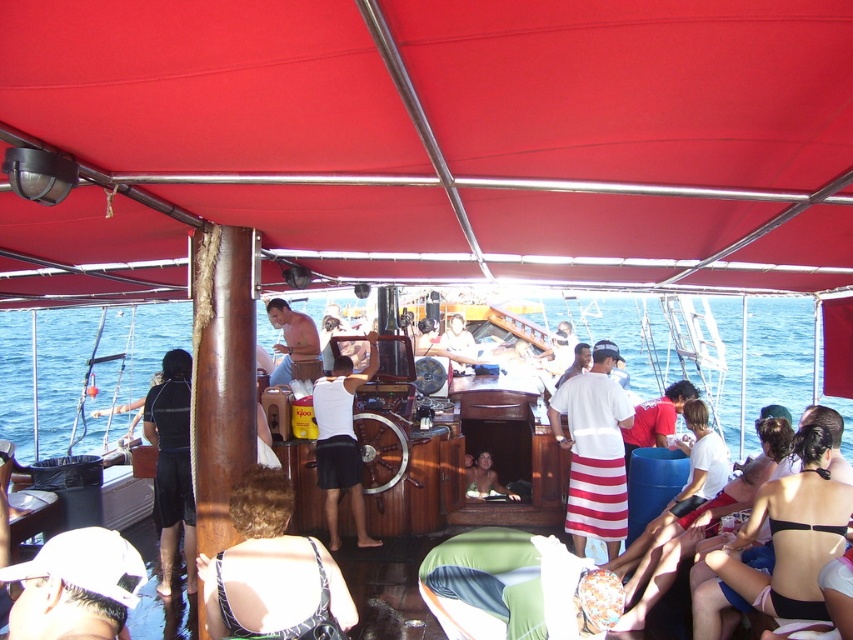
Is point (598, 326) positioned in front of point (601, 483)?

No.

How much distance is there between blue water at center and white striped fabric at center?

31.35 feet

Which is behind, point (167, 333) or point (582, 426)?

The point (167, 333) is behind.

I want to click on blue water at center, so click(x=776, y=356).

Which of these two, red fabric canopy at upper center or patterned fabric bikini at center, stands shorter?

red fabric canopy at upper center

The height and width of the screenshot is (640, 853). What do you see at coordinates (431, 141) in the screenshot? I see `red fabric canopy at upper center` at bounding box center [431, 141].

Is point (672, 188) closer to camera compared to point (242, 605)?

Yes, point (672, 188) is closer to viewer.

The height and width of the screenshot is (640, 853). I want to click on red fabric canopy at upper center, so click(431, 141).

Between point (781, 484) and point (277, 326), which one is positioned behind?

The point (277, 326) is more distant.

Who is higher up, black bikini top at lower right or smooth tan skin at center?

smooth tan skin at center is higher up.

Is point (842, 488) positioned behind point (311, 321)?

No, (842, 488) is closer to viewer.

At what (x,y) coordinates should I click in order to perform the action: click on black bikini top at lower right. Please return your answer as a coordinate pair (x, y). Looking at the image, I should click on (782, 541).